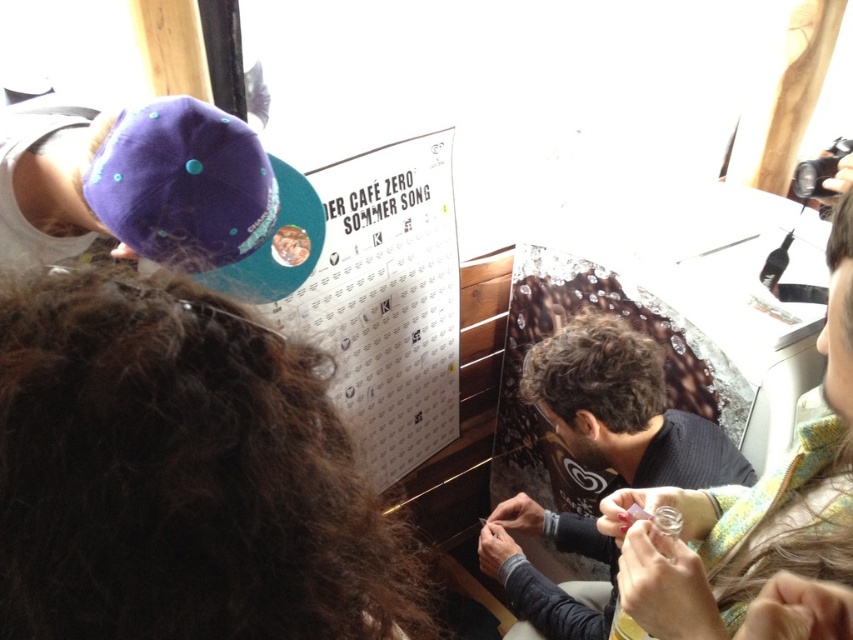
You are at a social event and want to approach the dark gray sweater at center. However, there is a brown fuzzy hair at upper left in your path. Can you walk around it easily?

The brown fuzzy hair at upper left has a smaller size compared to dark gray sweater at center, so it is likely easier to walk around it since it takes up less space.

You are trying to decide which object is narrower between the brown fuzzy hair at upper left and the green fabric scarf at lower right. Based on the scene description, which one is narrower?

The brown fuzzy hair at upper left is thinner than the green fabric scarf at lower right, so the brown fuzzy hair at upper left is narrower.